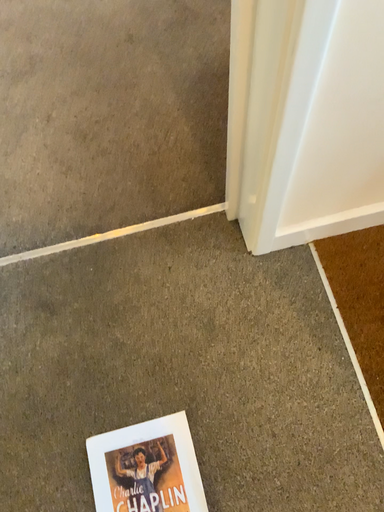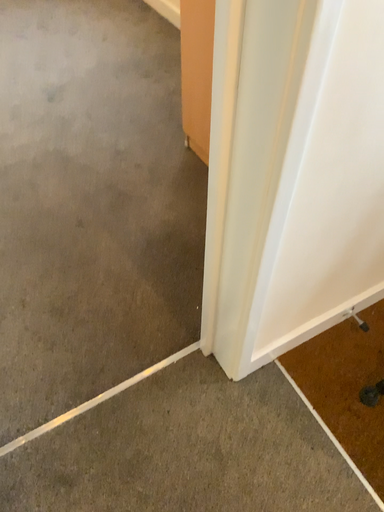
Question: Which way did the camera rotate in the video?

Choices:
 (A) rotated downward
 (B) rotated upward

Answer: (B)